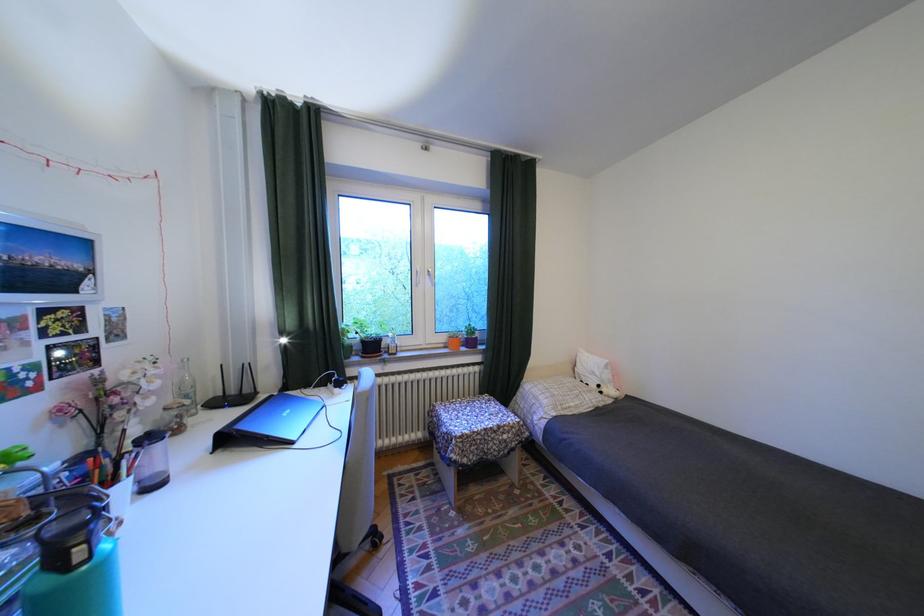
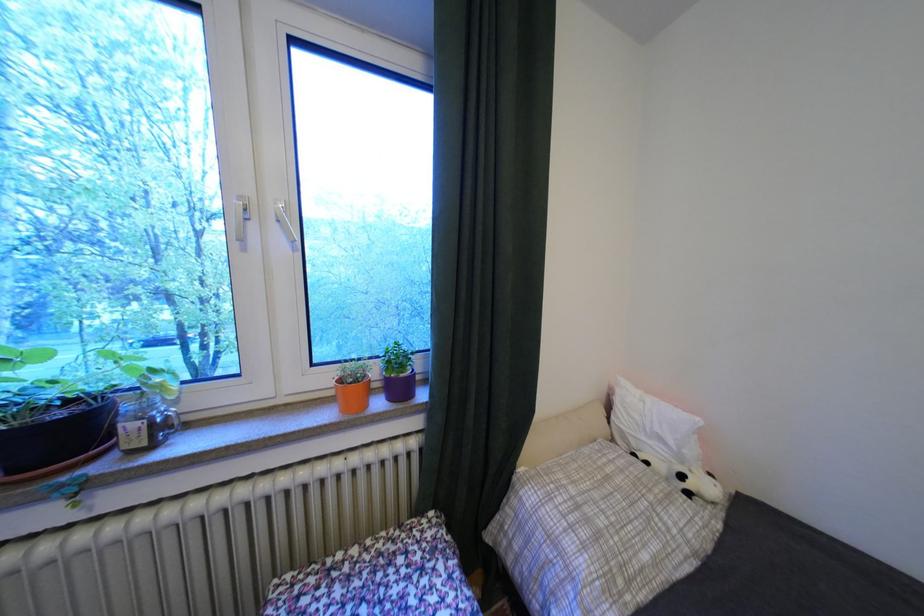
Where in the second image is the point corresponding to pixel 384 347 from the first image?

(75, 436)